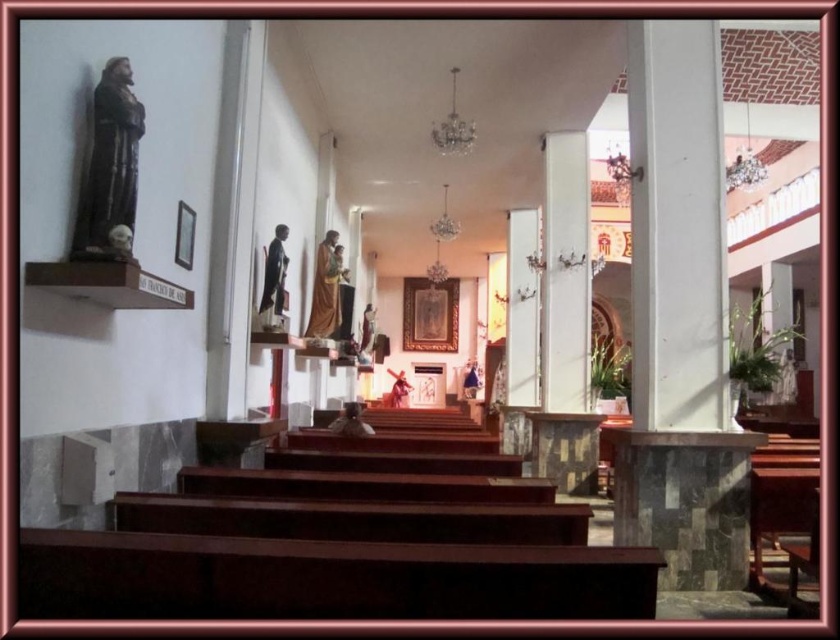
In order to click on matte brown statue at left in this screenshot , I will do `click(109, 168)`.

Who is shorter, matte brown statue at left or wooden statue at center?

matte brown statue at left

Is point (130, 243) positioned before point (324, 266)?

Yes, point (130, 243) is in front of point (324, 266).

Find the location of a particular element. The image size is (840, 640). matte brown statue at left is located at coordinates (109, 168).

Is point (693, 584) in front of point (279, 257)?

Yes, point (693, 584) is closer to viewer.

Is white marble pillar at right further to the viewer compared to matte black statue at center?

No, it is in front of matte black statue at center.

Describe the element at coordinates (680, 317) in the screenshot. I see `white marble pillar at right` at that location.

You are a GUI agent. You are given a task and a screenshot of the screen. Output one action in this format:
    pyautogui.click(x=<x>, y=<y>)
    Task: Click on the white marble pillar at right
    This screenshot has width=840, height=640.
    Given the screenshot: What is the action you would take?
    pyautogui.click(x=680, y=317)

Between white marble pillar at right and wooden statue at center, which one has less height?

With less height is wooden statue at center.

Between white marble pillar at right and wooden statue at center, which one appears on the right side from the viewer's perspective?

Positioned to the right is white marble pillar at right.

Find the location of a particular element. Image resolution: width=840 pixels, height=640 pixels. white marble pillar at right is located at coordinates (680, 317).